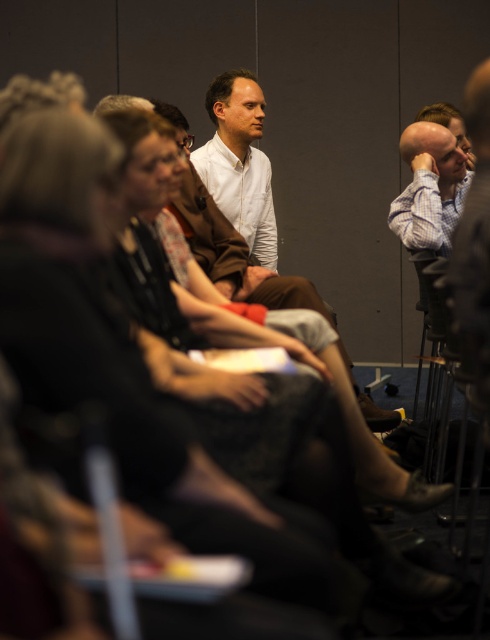
Question: Which of the following is the closest to the observer?

Choices:
 (A) white shirt at center
 (B) light blue shirt at right

Answer: (B)

Question: Is white shirt at center positioned before light blue shirt at right?

Choices:
 (A) no
 (B) yes

Answer: (A)

Question: Is white shirt at center to the left of light blue shirt at right from the viewer's perspective?

Choices:
 (A) no
 (B) yes

Answer: (B)

Question: Is white shirt at center bigger than light blue shirt at right?

Choices:
 (A) yes
 (B) no

Answer: (B)

Question: Which point is farther from the camera taking this photo?

Choices:
 (A) (450, 157)
 (B) (226, 120)

Answer: (B)